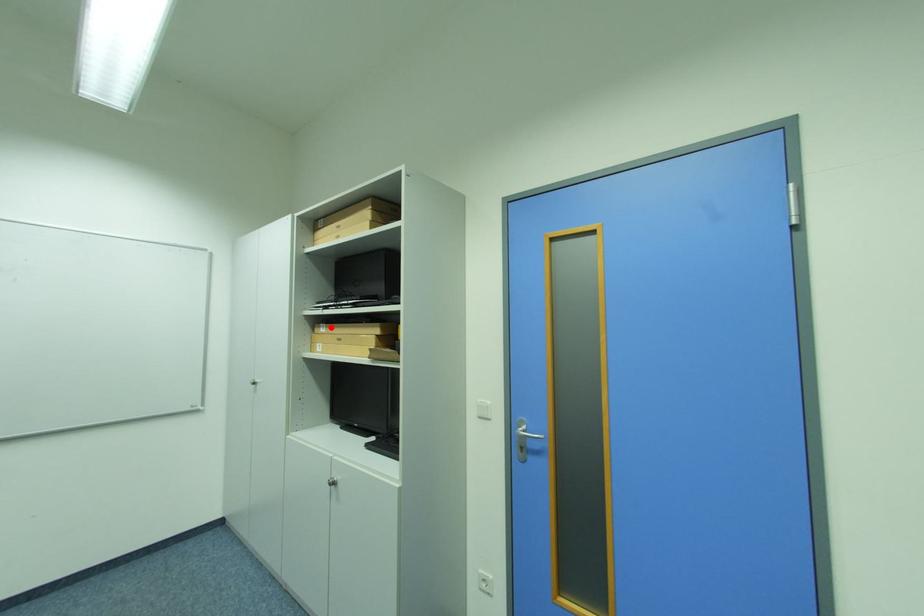
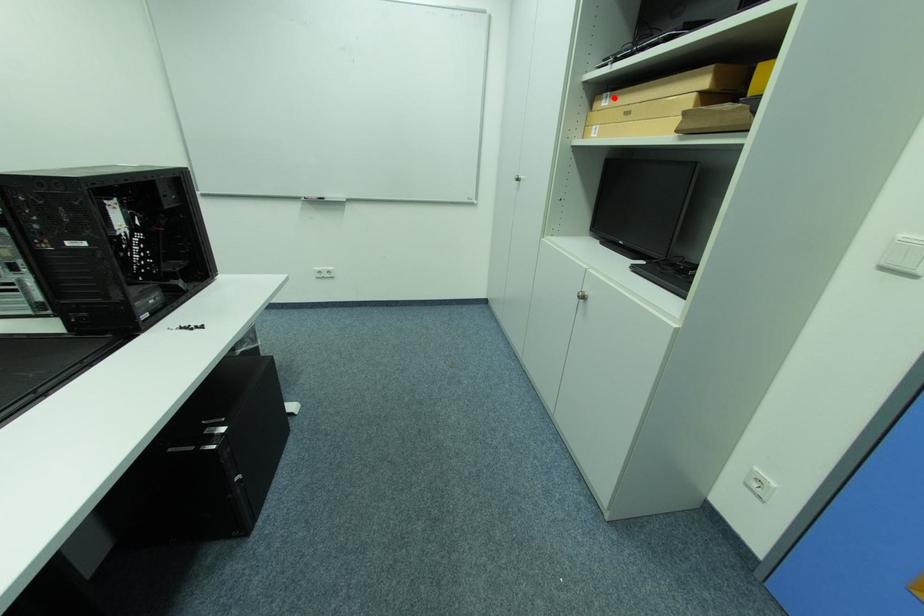
I am providing you with two images of the same scene from different viewpoints. A red point is marked on the first image and another point is marked on the second image. Does the point marked in image1 correspond to the same location as the one in image2?

Yes